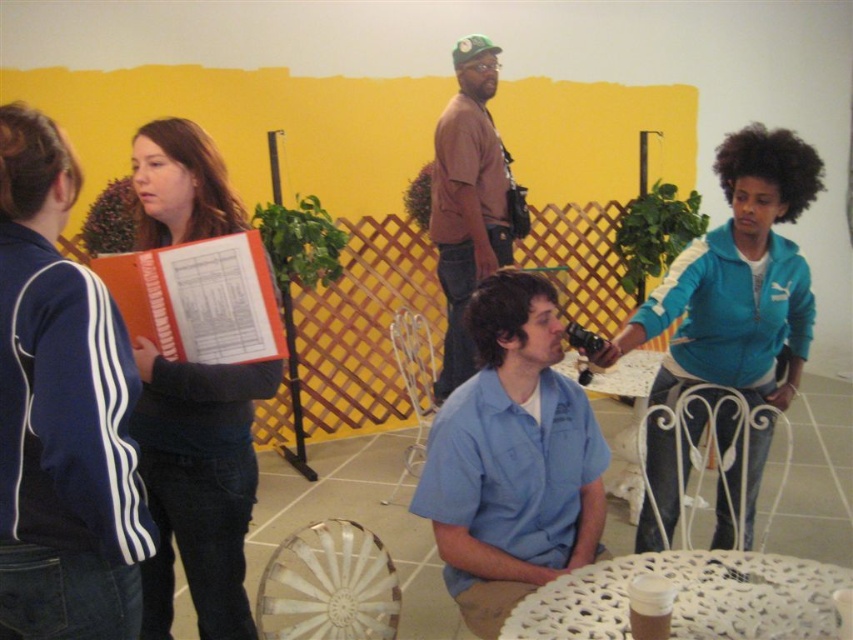
Question: Estimate the real-world distances between objects in this image. Which object is closer to the blue cotton shirt at center?

Choices:
 (A) white wrought iron chair at lower right
 (B) white plastic chair at lower center
 (C) brown cotton shirt at center
 (D) blue fleece jacket at right

Answer: (B)

Question: Can you confirm if white lace table at lower center is positioned to the left of metallic wire chair at center?

Choices:
 (A) yes
 (B) no

Answer: (B)

Question: Which point appears closest to the camera in this image?

Choices:
 (A) (317, 588)
 (B) (483, 182)
 (C) (165, 124)

Answer: (C)

Question: Estimate the real-world distances between objects in this image. Which object is farther from the matte orange folder at upper left?

Choices:
 (A) white lace table at lower center
 (B) blue fleece jacket at right
 (C) brown cotton shirt at center
 (D) white plastic chair at lower center

Answer: (C)

Question: Is blue denim jacket at left positioned before brown cotton shirt at center?

Choices:
 (A) no
 (B) yes

Answer: (B)

Question: From the image, what is the correct spatial relationship of matte orange folder at upper left in relation to white plastic chair at lower center?

Choices:
 (A) below
 (B) above

Answer: (B)